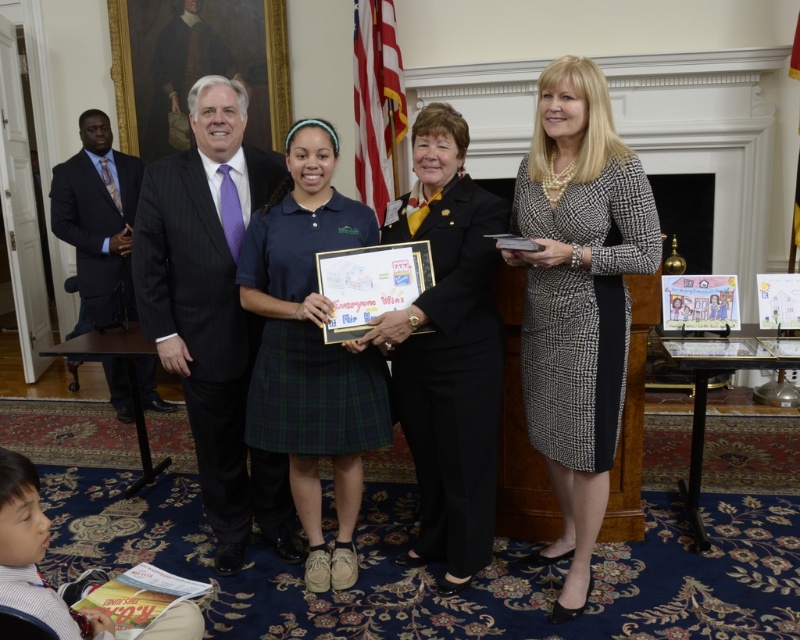
In the formal indoor setting, there are two people wearing the black and white textured dress at center and the dark gray pinstripe suit at center. Which one is taller?

The black and white textured dress at center is taller than the dark gray pinstripe suit at center.